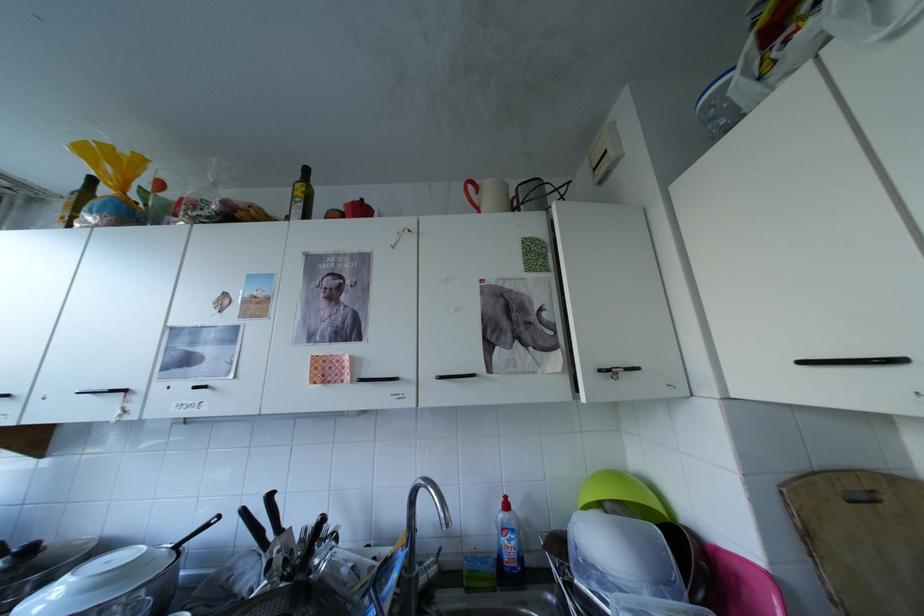
Find where to grasp the black knife handle. Please return your answer as a coordinate pair (x, y).

(272, 509)